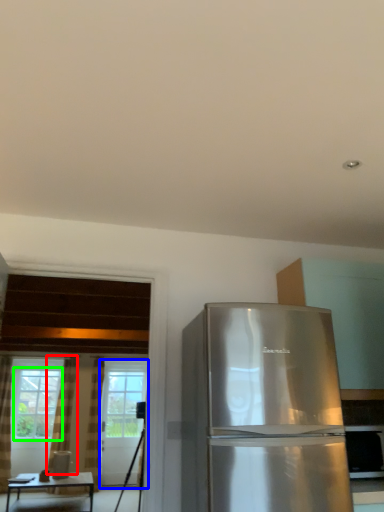
Question: Estimate the real-world distances between objects in this image. Which object is closer to curtain (highlighted by a red box), screen door (highlighted by a blue box) or window (highlighted by a green box)?

Choices:
 (A) screen door
 (B) window

Answer: (B)